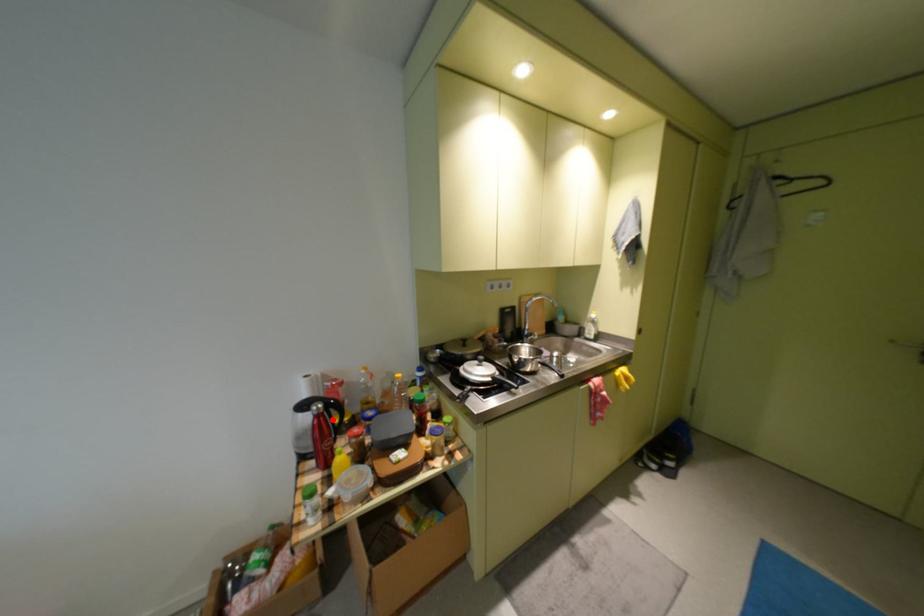
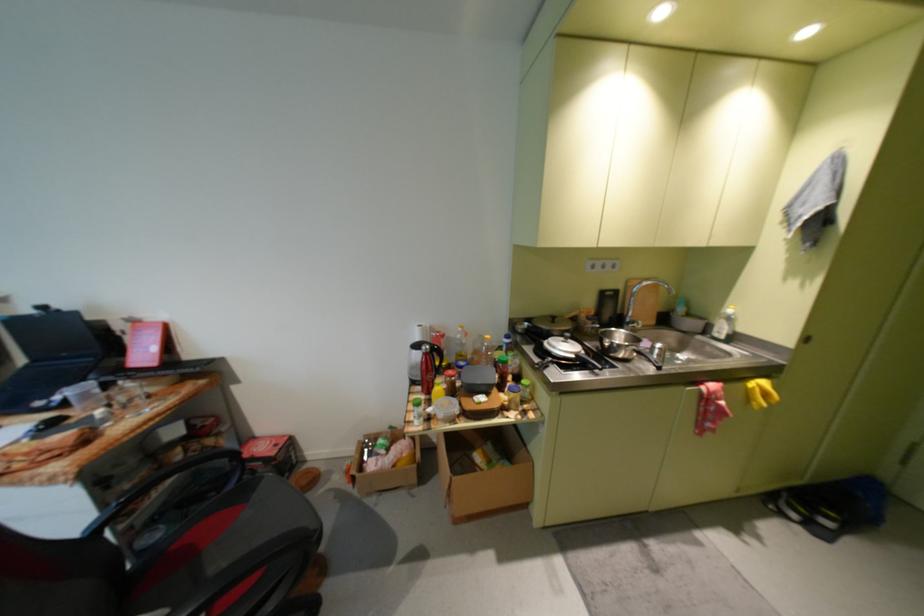
Question: A red point is marked in image1. In image2, is the corresponding 3D point closer to the camera or farther? Reply with the corresponding letter.

Choices:
 (A) The corresponding 3D point is closer.
 (B) The corresponding 3D point is farther.

Answer: (B)